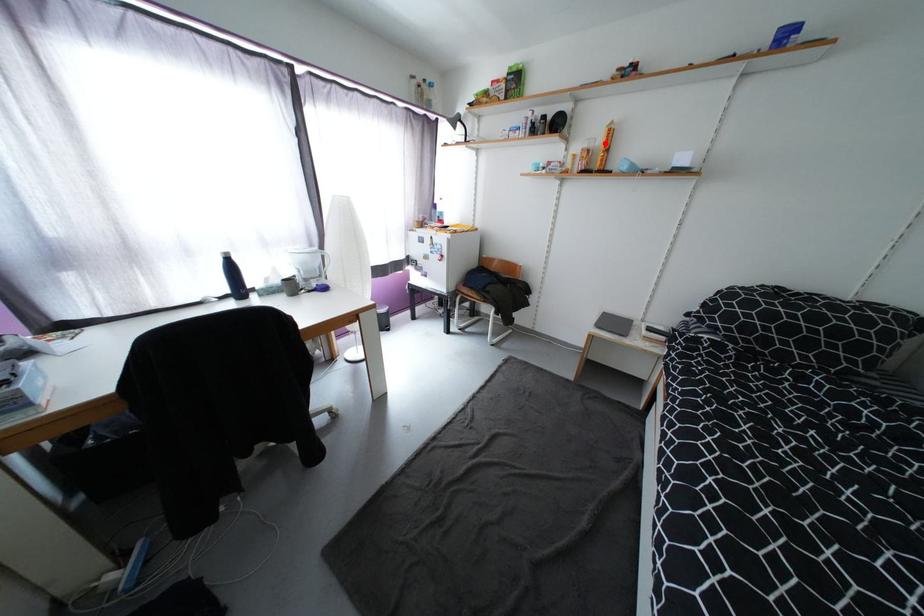
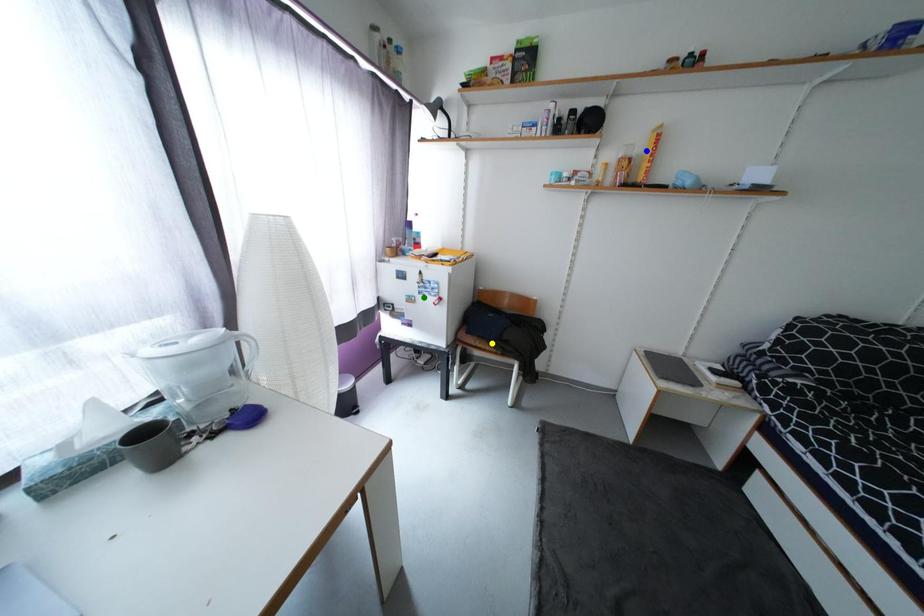
Question: I am providing you with two images of the same scene from different viewpoints. A red point is marked on the first image. You are given multiple points on the second image. Which point in image 2 is actually the same real-world point as the red point in image 1?

Choices:
 (A) yellow point
 (B) green point
 (C) blue point

Answer: (C)